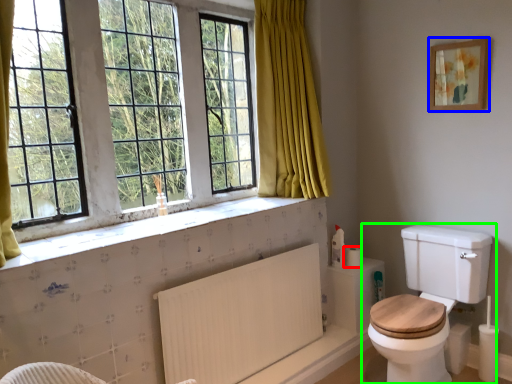
Question: Based on their relative distances, which object is farther from toilet paper (highlighted by a red box)? Choose from picture frame (highlighted by a blue box) and toilet (highlighted by a green box).

Choices:
 (A) picture frame
 (B) toilet

Answer: (A)